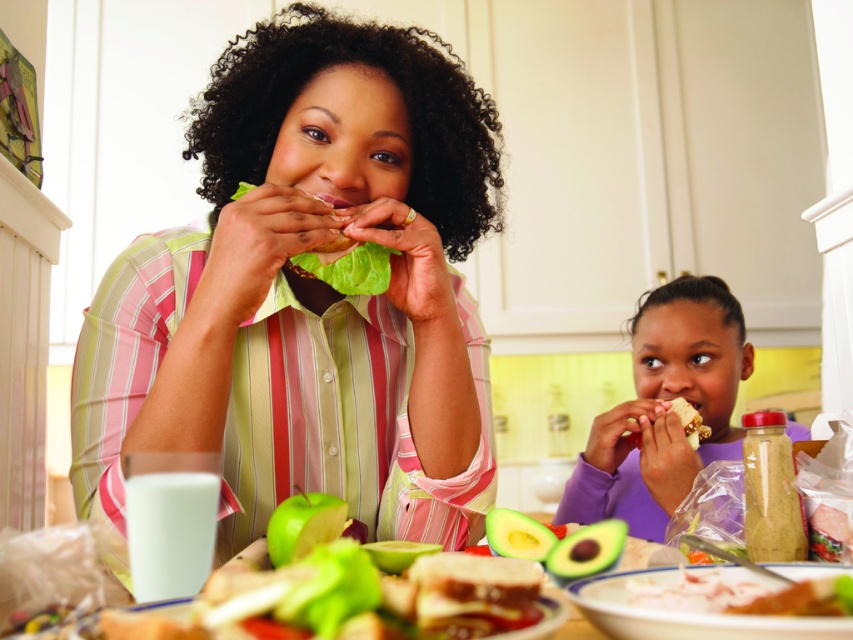
Question: Among these objects, which one is farthest from the camera?

Choices:
 (A) purple matte shirt at lower right
 (B) smooth white bread at right

Answer: (B)

Question: Can you confirm if purple matte shirt at lower right is positioned below smooth white bread at right?

Choices:
 (A) no
 (B) yes

Answer: (A)

Question: Is matte green shirt at center to the right of purple matte shirt at lower right from the viewer's perspective?

Choices:
 (A) yes
 (B) no

Answer: (B)

Question: Which point is closer to the camera taking this photo?

Choices:
 (A) click(675, 304)
 (B) click(708, 429)
 (C) click(239, 548)

Answer: (C)

Question: Can you confirm if matte green shirt at center is positioned above smooth white bread at right?

Choices:
 (A) yes
 (B) no

Answer: (A)

Question: Estimate the real-world distances between objects in this image. Which object is farther from the smooth white bread at right?

Choices:
 (A) purple matte shirt at lower right
 (B) matte green shirt at center

Answer: (B)